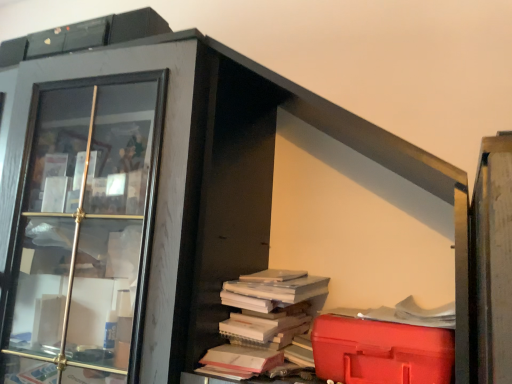
Question: Choose the correct answer: Is white paper book at center inside red plastic toolbox at lower right or outside it?

Choices:
 (A) inside
 (B) outside

Answer: (B)

Question: Is white paper book at center taller or shorter than red plastic toolbox at lower right?

Choices:
 (A) tall
 (B) short

Answer: (A)

Question: Which is nearer to the white paper book at center?

Choices:
 (A) red plastic toolbox at lower right
 (B) matte glass cabinet at left

Answer: (A)

Question: Considering the real-world distances, which object is closest to the white paper book at center?

Choices:
 (A) matte glass cabinet at left
 (B) red plastic toolbox at lower right

Answer: (B)